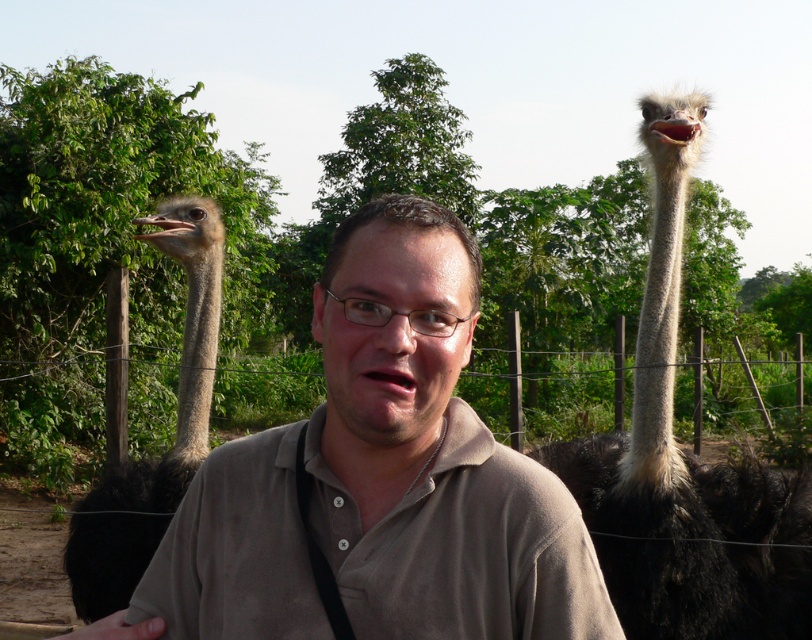
You are a photographer trying to capture a clear shot of the brown cotton shirt at center and the dark brown feathers at right. Which object should you focus on first if you want to ensure both are in focus?

The brown cotton shirt at center is shorter than the dark brown feathers at right, so you should focus on the dark brown feathers at right first because it is farther away and requires a deeper focus to ensure both are in focus.

In the scene shown: You are a photographer trying to capture a clear photo of the dark brown feathers at right. However, the brown cotton shirt at center is blocking your view. Can you adjust your position to avoid the obstruction?

The brown cotton shirt at center is in front of the dark brown feathers at right, so moving your camera position to the left or right might allow you to capture the dark brown feathers at right without obstruction.

You are a photographer trying to capture a photo of the dark brown feathers at left and the brown matte shirt at center. Given that your camera has a maximum focus range of 8 feet, will both objects be in focus?

The dark brown feathers at left and brown matte shirt at center are 8.05 feet apart. Since the distance between them exceeds the camera maximum focus range of 8 feet, the camera cannot focus on both objects simultaneously.